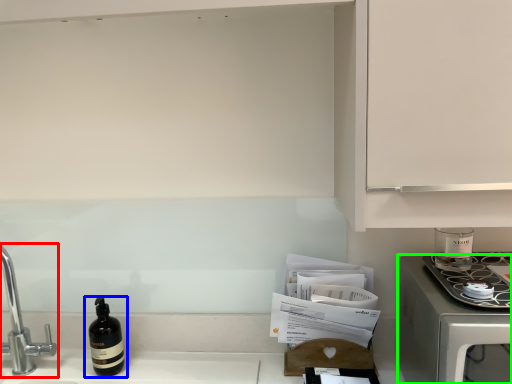
Question: Estimate the real-world distances between objects in this image. Which object is closer to tap (highlighted by a red box), bottle (highlighted by a blue box) or home appliance (highlighted by a green box)?

Choices:
 (A) bottle
 (B) home appliance

Answer: (A)